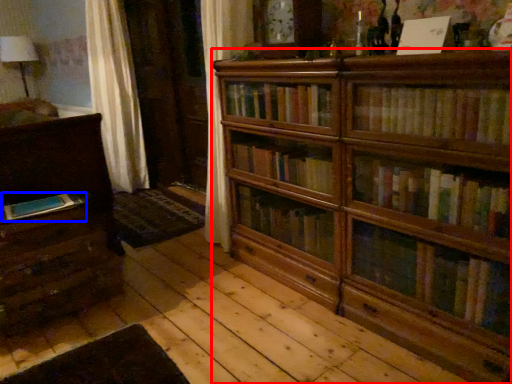
Question: Which of the following is the closest to the observer, bookcase (highlighted by a red box) or book (highlighted by a blue box)?

Choices:
 (A) bookcase
 (B) book

Answer: (A)